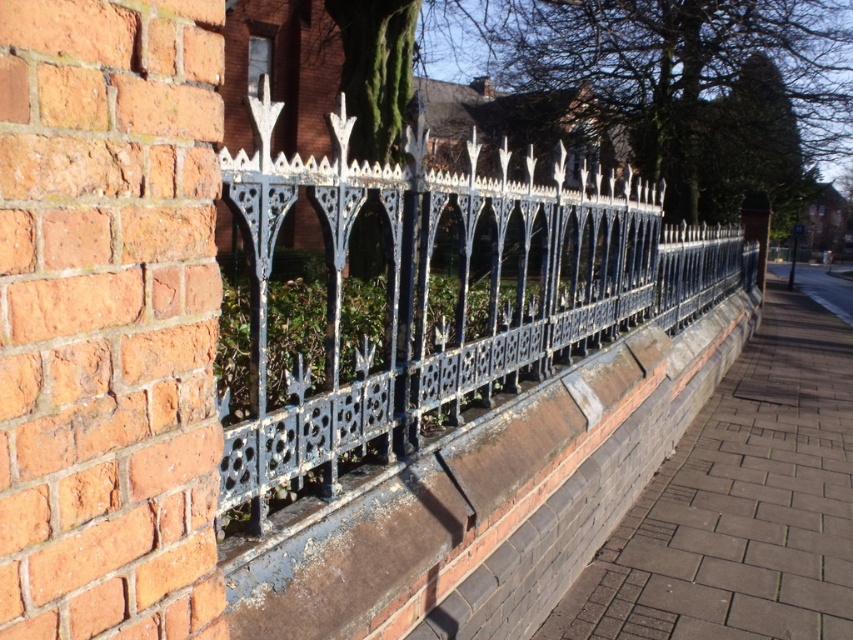
Question: Does blue wrought iron fence at center appear over gray brick pavement at lower right?

Choices:
 (A) yes
 (B) no

Answer: (A)

Question: Which point appears farthest from the camera in this image?

Choices:
 (A) (607, 497)
 (B) (306, 412)

Answer: (A)

Question: Considering the real-world distances, which object is farthest from the gray brick pavement at lower right?

Choices:
 (A) black brick ledge at center
 (B) blue wrought iron fence at center

Answer: (A)

Question: Which point is closer to the camera?

Choices:
 (A) black brick ledge at center
 (B) gray brick pavement at lower right

Answer: (A)

Question: Is blue wrought iron fence at center thinner than gray brick pavement at lower right?

Choices:
 (A) no
 (B) yes

Answer: (B)

Question: Does blue wrought iron fence at center have a lesser width compared to gray brick pavement at lower right?

Choices:
 (A) yes
 (B) no

Answer: (A)